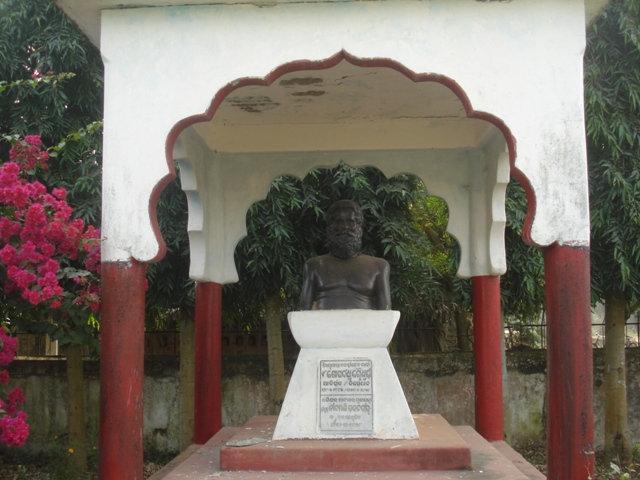
Identify the location of pedestal. The height and width of the screenshot is (480, 640). (352, 331).